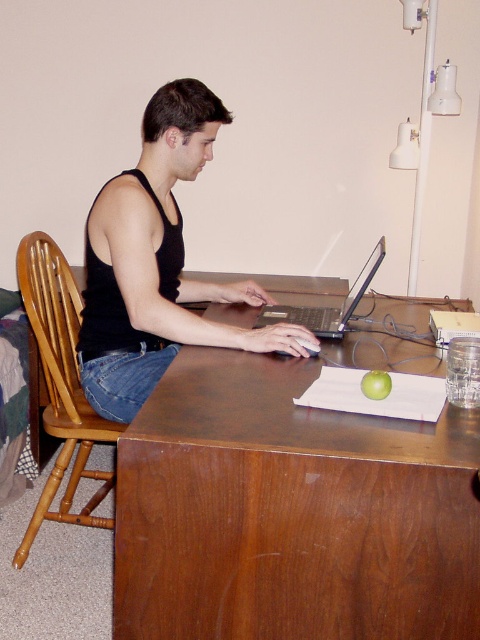
Where is `black matte tank top at center`? This screenshot has height=640, width=480. black matte tank top at center is located at coordinates (156, 262).

Which of these two, black matte tank top at center or green matte apple at center, stands shorter?

Standing shorter between the two is green matte apple at center.

Which is in front, point (149, 148) or point (369, 371)?

Point (369, 371) is in front.

Locate an element on the screen. This screenshot has width=480, height=640. black matte tank top at center is located at coordinates (156, 262).

Does brown wood table at center have a greater width compared to black matte tank top at center?

Indeed, brown wood table at center has a greater width compared to black matte tank top at center.

Does brown wood table at center come behind black matte tank top at center?

No, brown wood table at center is closer to the viewer.

Based on the photo, who is more forward, (228, 572) or (175, 205)?

Point (228, 572) is more forward.

Find the location of `brown wood table at center`. brown wood table at center is located at coordinates (290, 512).

Where is `brown wood table at center`? brown wood table at center is located at coordinates (290, 512).

Looking at this image, is brown wood table at center smaller than green matte apple at center?

No, brown wood table at center is not smaller than green matte apple at center.

I want to click on brown wood table at center, so click(290, 512).